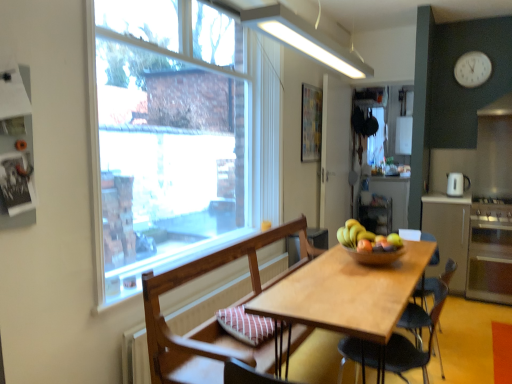
Where is `free spot above white plastic clock at upper right (from a real-world perspective)`? The width and height of the screenshot is (512, 384). free spot above white plastic clock at upper right (from a real-world perspective) is located at coordinates pyautogui.click(x=473, y=45).